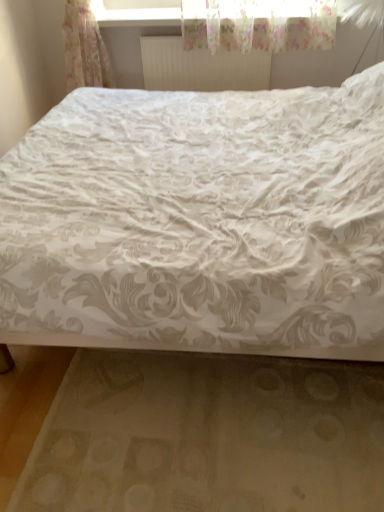
Identify the location of free point above white fabric bed frame at lower center (from a real-world perspective). (187, 437).